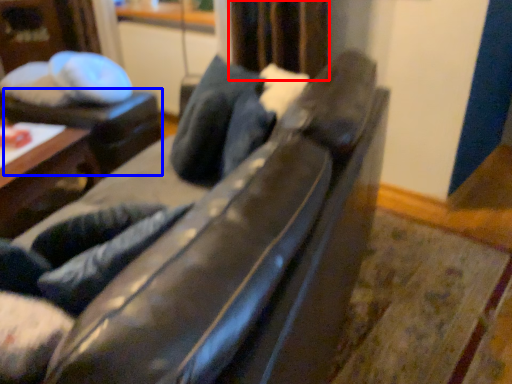
Question: Which of the following is the closest to the observer, curtain (highlighted by a red box) or table (highlighted by a blue box)?

Choices:
 (A) curtain
 (B) table

Answer: (A)